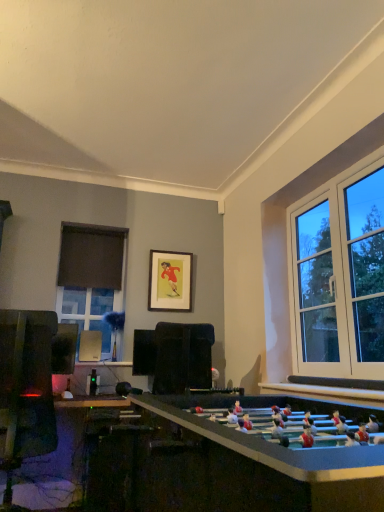
Question: Is the depth of wooden framed picture at center less than that of black fabric curtain at left?

Choices:
 (A) yes
 (B) no

Answer: (A)

Question: Is wooden framed picture at center oriented towards black fabric curtain at left?

Choices:
 (A) no
 (B) yes

Answer: (A)

Question: Are wooden framed picture at center and black fabric curtain at left making contact?

Choices:
 (A) no
 (B) yes

Answer: (A)

Question: Is the depth of wooden framed picture at center greater than that of black fabric curtain at left?

Choices:
 (A) no
 (B) yes

Answer: (A)

Question: Can you confirm if wooden framed picture at center is smaller than black fabric curtain at left?

Choices:
 (A) no
 (B) yes

Answer: (B)

Question: Considering the relative positions of wooden framed picture at center and black fabric curtain at left in the image provided, is wooden framed picture at center to the left of black fabric curtain at left from the viewer's perspective?

Choices:
 (A) no
 (B) yes

Answer: (A)

Question: Can you confirm if wooden framed picture at center is wider than matte glass window at left?

Choices:
 (A) yes
 (B) no

Answer: (B)

Question: Is wooden framed picture at center in front of matte glass window at left?

Choices:
 (A) yes
 (B) no

Answer: (B)

Question: From the image's perspective, is wooden framed picture at center located above matte glass window at left?

Choices:
 (A) no
 (B) yes

Answer: (B)

Question: Is matte glass window at left located within wooden framed picture at center?

Choices:
 (A) no
 (B) yes

Answer: (A)

Question: Can we say wooden framed picture at center lies outside matte glass window at left?

Choices:
 (A) yes
 (B) no

Answer: (A)

Question: Can you confirm if wooden framed picture at center is positioned to the left of matte glass window at left?

Choices:
 (A) no
 (B) yes

Answer: (A)

Question: From the image's perspective, would you say matte glass window at left is shown under black fabric curtain at left?

Choices:
 (A) no
 (B) yes

Answer: (B)